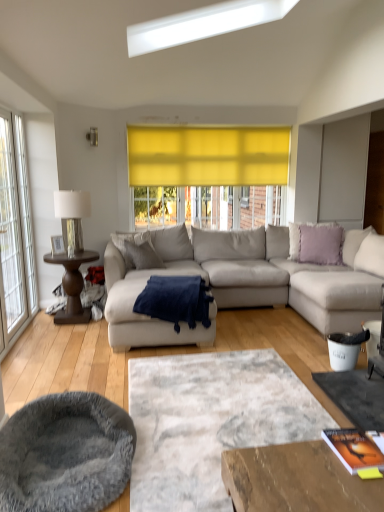
Question: From their relative heights in the image, would you say gray plush cat bed at lower left is taller or shorter than light gray fabric couch at center?

Choices:
 (A) short
 (B) tall

Answer: (A)

Question: Is gray plush cat bed at lower left situated inside light gray fabric couch at center or outside?

Choices:
 (A) outside
 (B) inside

Answer: (A)

Question: Considering the real-world distances, which object is farthest from the metallic silver lamp at left?

Choices:
 (A) brown wood side table at left
 (B) textured gray rug at center
 (C) light gray fabric couch at center
 (D) gray fabric pillow at center, which is the 2th pillow from right to left
 (E) clear glass window at left

Answer: (B)

Question: Which of these objects is positioned farthest from the light gray fabric couch at center?

Choices:
 (A) metallic silver lamp at left
 (B) navy blue plush blanket at center
 (C) brown wood side table at left
 (D) clear glass window at left
 (E) textured gray rug at center

Answer: (D)